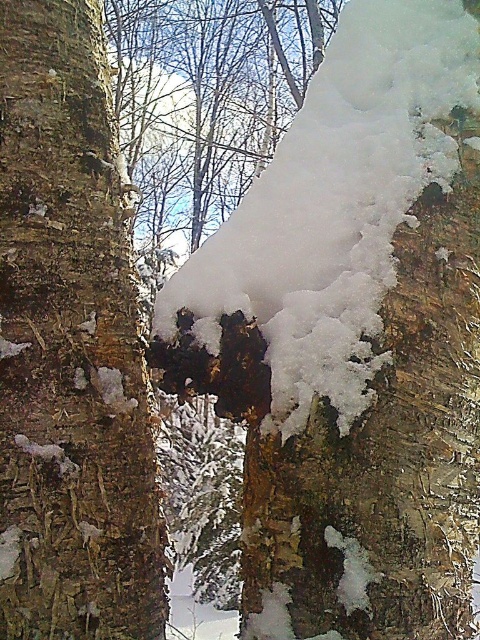
Between brown textured bark at center and white fluffy snow at center, which one is positioned lower?

brown textured bark at center is lower down.

Which is behind, point (81, 547) or point (387, 76)?

Point (387, 76)

Image resolution: width=480 pixels, height=640 pixels. Identify the location of brown textured bark at center. (70, 348).